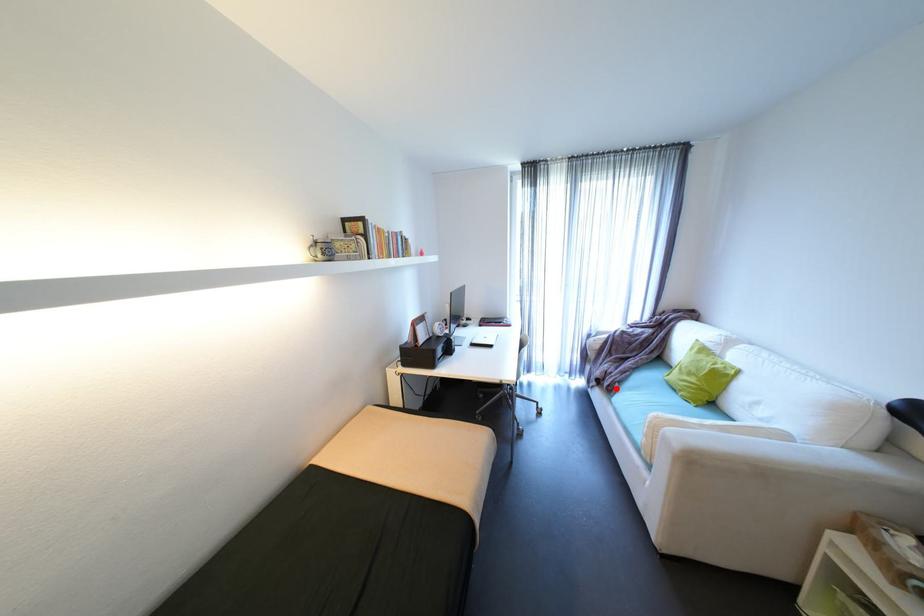
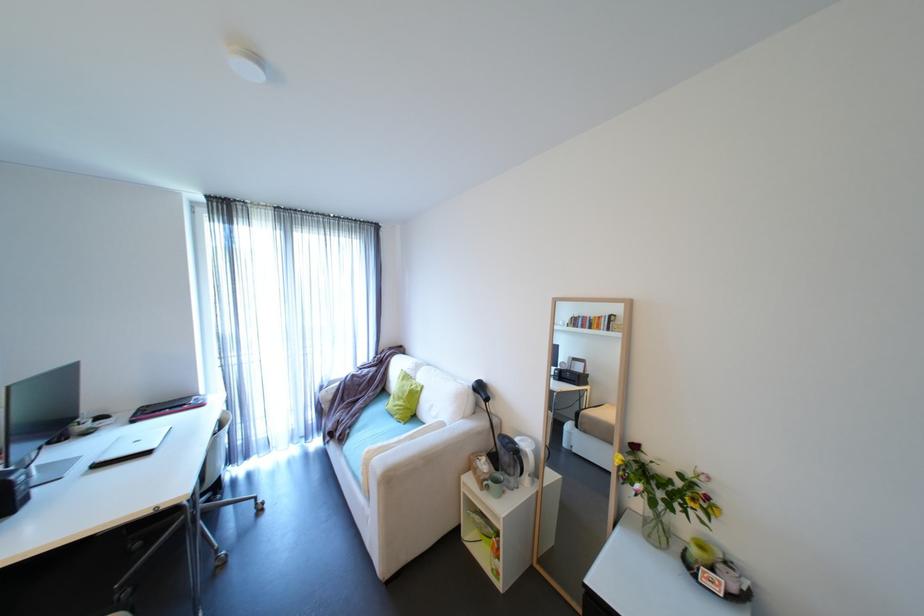
Where in the second image is the point corresponding to the highlighted location from the first image?

(347, 438)